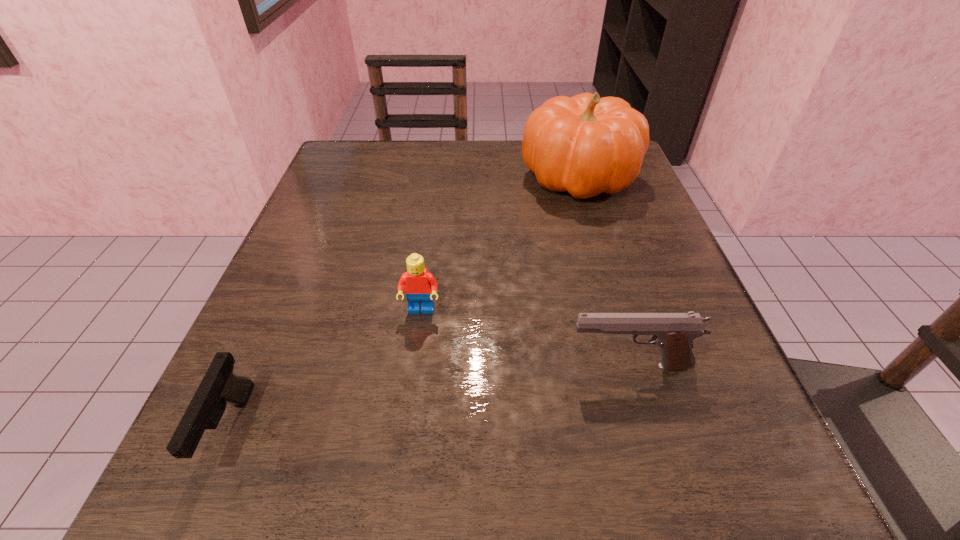
Identify the location of free space located 0.280m at the barrel of the farther pistol. The width and height of the screenshot is (960, 540). pos(372,366).

Find the location of a particular element. vacant space located at the barrel of the farther pistol is located at coordinates (x=470, y=366).

Find the location of a particular element. blank space located on the face of the second farthest object is located at coordinates (407, 418).

Identify the location of object at the far edge. (586, 145).

Locate an element on the screen. object that is at the near edge is located at coordinates (219, 386).

Locate an element on the screen. object at the left edge is located at coordinates (219, 386).

Where is `pumpkin located in the right edge section of the desktop`? pumpkin located in the right edge section of the desktop is located at coordinates (586, 145).

Find the location of a particular element. This screenshot has width=960, height=540. pistol that is positioned at the right edge is located at coordinates (674, 332).

Locate an element on the screen. object that is positioned at the near left corner is located at coordinates (219, 386).

What are the coordinates of `object present at the far right corner` in the screenshot? It's located at (586, 145).